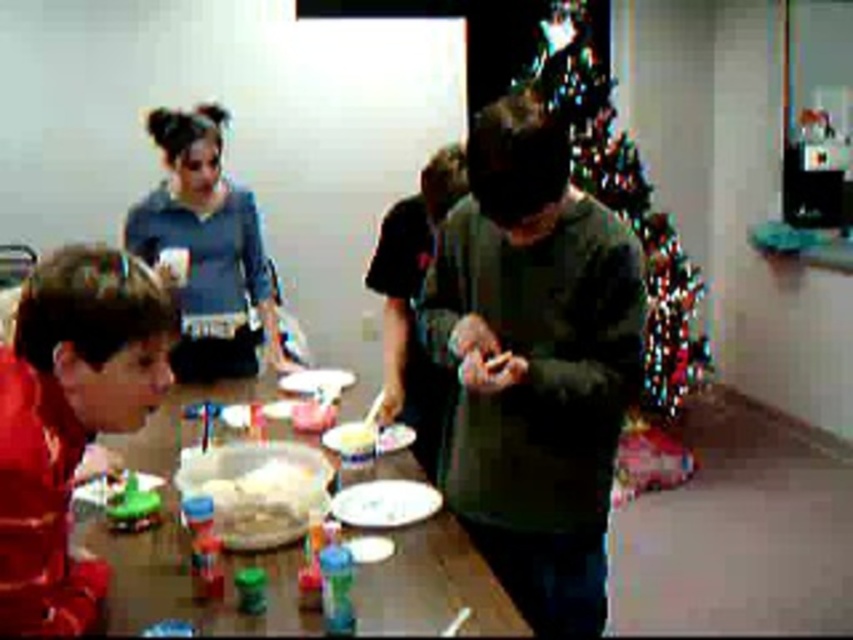
Question: Considering the real-world distances, which object is closest to the white glossy plate at center?

Choices:
 (A) green plastic cup at lower left
 (B) white fluffy cake at center

Answer: (B)

Question: Observing the image, what is the correct spatial positioning of dark green sweater at center in reference to blue fleece sweater at upper left?

Choices:
 (A) above
 (B) below

Answer: (B)

Question: Which object is farther from the camera taking this photo?

Choices:
 (A) white glossy plate at center
 (B) white fluffy cake at center
 (C) dark green sweater at center
 (D) white creamy cake at center

Answer: (D)

Question: Does green plastic cup at lower left appear under white creamy cake at center?

Choices:
 (A) no
 (B) yes

Answer: (B)

Question: Among these objects, which one is farthest from the camera?

Choices:
 (A) green plastic cup at lower left
 (B) white fluffy cake at center

Answer: (A)

Question: Is dark green sweater at center to the right of blue fleece sweater at upper left from the viewer's perspective?

Choices:
 (A) yes
 (B) no

Answer: (A)